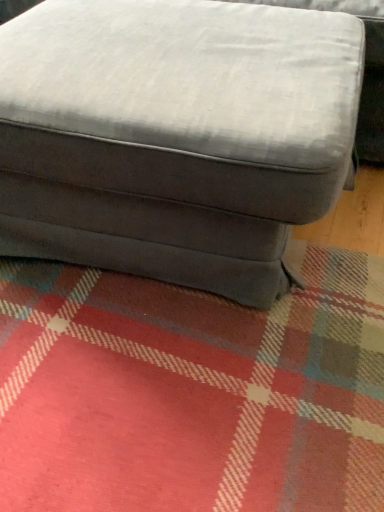
This screenshot has width=384, height=512. What are the coordinates of `gray fabric ottoman at center` in the screenshot? It's located at (174, 135).

The image size is (384, 512). Describe the element at coordinates (174, 135) in the screenshot. I see `gray fabric ottoman at center` at that location.

Find the location of `gray fabric ottoman at center`. gray fabric ottoman at center is located at coordinates (174, 135).